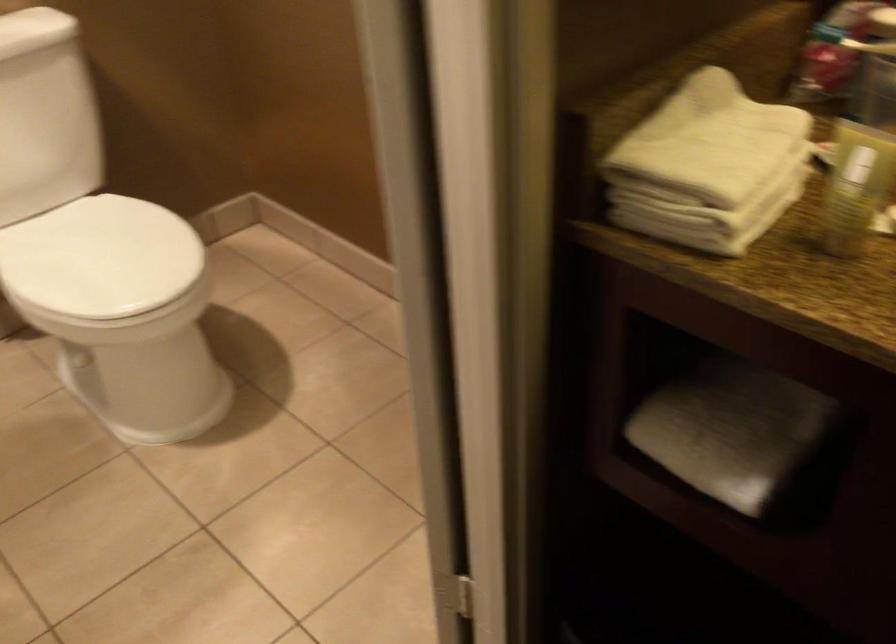
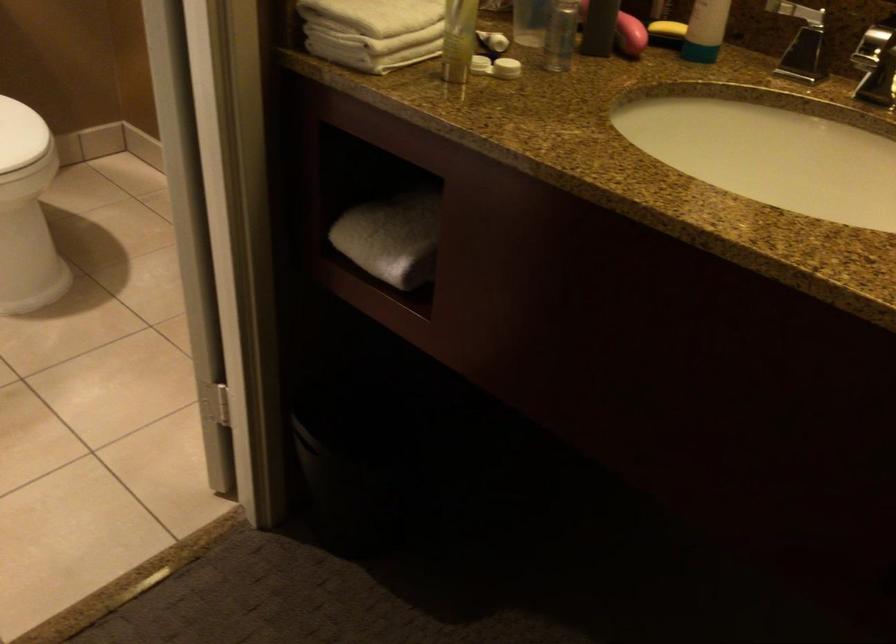
In the second image, find the point that corresponds to (x=721, y=166) in the first image.

(380, 14)